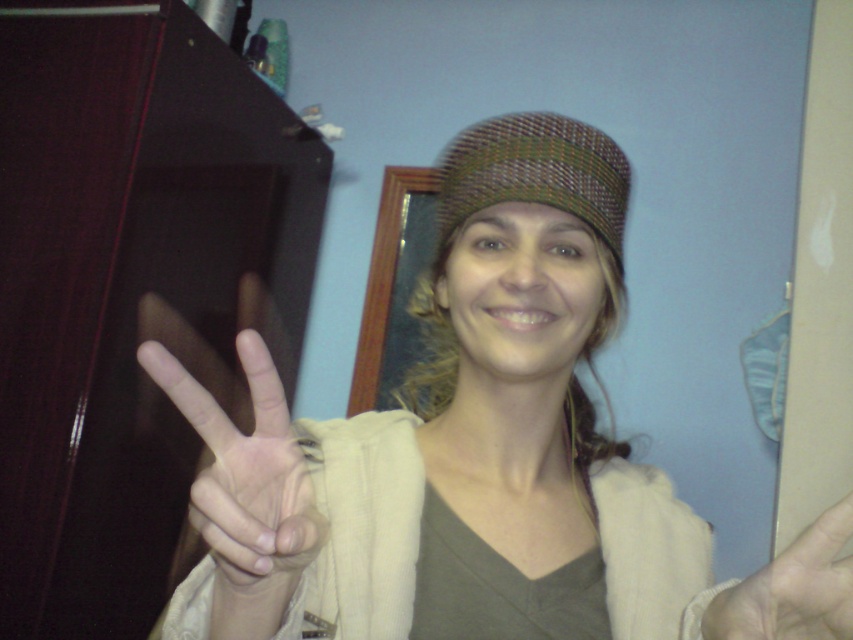
You are standing in the room and want to place a small plant between the two points, point (x=350, y=490) and point (x=537, y=152). Which point should the plant be closer to so it is in front of the other point?

The plant should be closer to point (x=537, y=152) because point (x=350, y=490) is behind point (x=537, y=152), so placing it near the front point would ensure it is in front of the other.

You are a photographer setting up for a photo shoot. You notice two hands in the frame, the white matte hand at center and the matte beige hand at center. The client wants to ensure that the hand with the larger width is visible. Which hand should you focus on?

The white matte hand at center has a larger width than the matte beige hand at center, so you should focus on the white matte hand at center to ensure the wider hand is visible.

You are a photographer setting up a shot of the person in the scene. You need to ensure that the two hands are at least 8 inches apart for the composition. Based on the image, will the white matte hand at center and the matte beige hand at center meet this requirement?

The distance between the white matte hand at center and the matte beige hand at center is 9.11 inches, which exceeds the required 8 inches, so they meet the composition requirement.